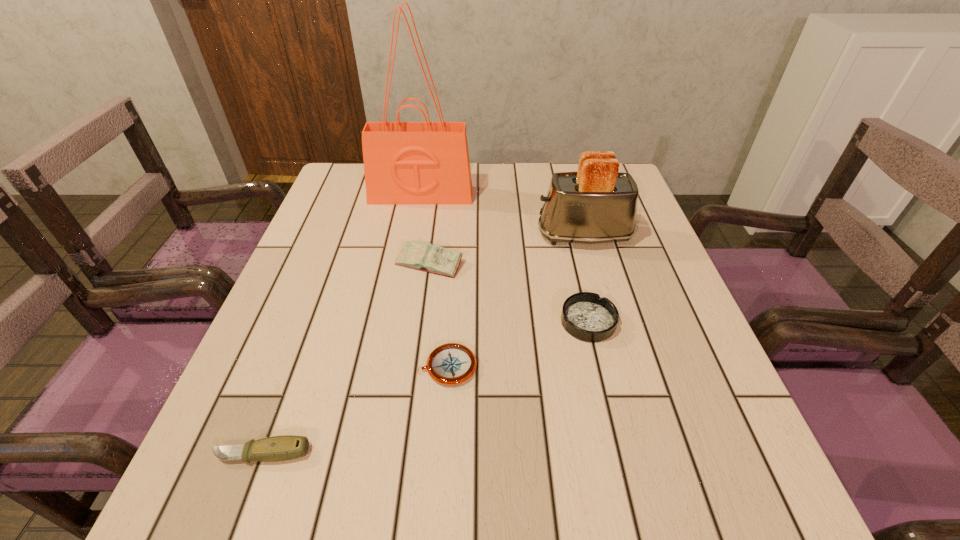
Find the location of a particular element. free space located 0.350m on the side of the fifth shortest object with the control lever is located at coordinates (396, 236).

You are a GUI agent. You are given a task and a screenshot of the screen. Output one action in this format:
    pyautogui.click(x=<x>, y=<y>)
    Task: Click on the blank space located on the side of the fifth shortest object with the control lever
    The image size is (960, 540).
    Given the screenshot: What is the action you would take?
    pyautogui.click(x=428, y=236)

The image size is (960, 540). In order to click on free space located on the back of the diary in this screenshot , I will do pos(442,166).

Where is `vacant point located on the back of the ashtray`? vacant point located on the back of the ashtray is located at coordinates (563, 215).

This screenshot has width=960, height=540. Identify the location of vacant point located 0.150m on the back of the pocketknife. (295, 364).

Find the location of a particular element. This screenshot has height=540, width=960. free space located on the back of the shortest object is located at coordinates (454, 271).

Locate an element on the screen. This screenshot has width=960, height=540. object at the far edge is located at coordinates (426, 162).

Locate an element on the screen. object that is at the near edge is located at coordinates (287, 447).

I want to click on tote bag that is at the left edge, so click(x=426, y=162).

Find the location of `pocketknife situated at the left edge`. pocketknife situated at the left edge is located at coordinates (287, 447).